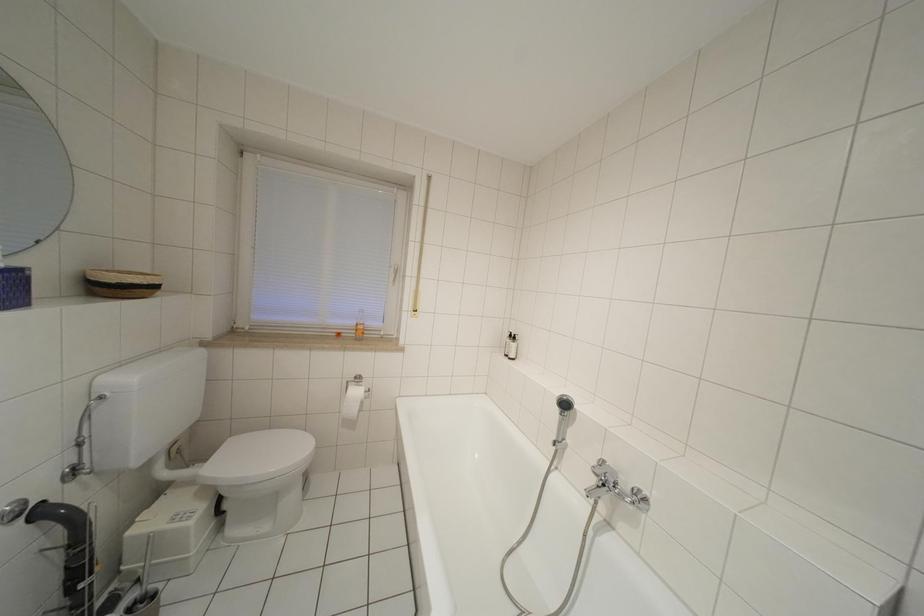
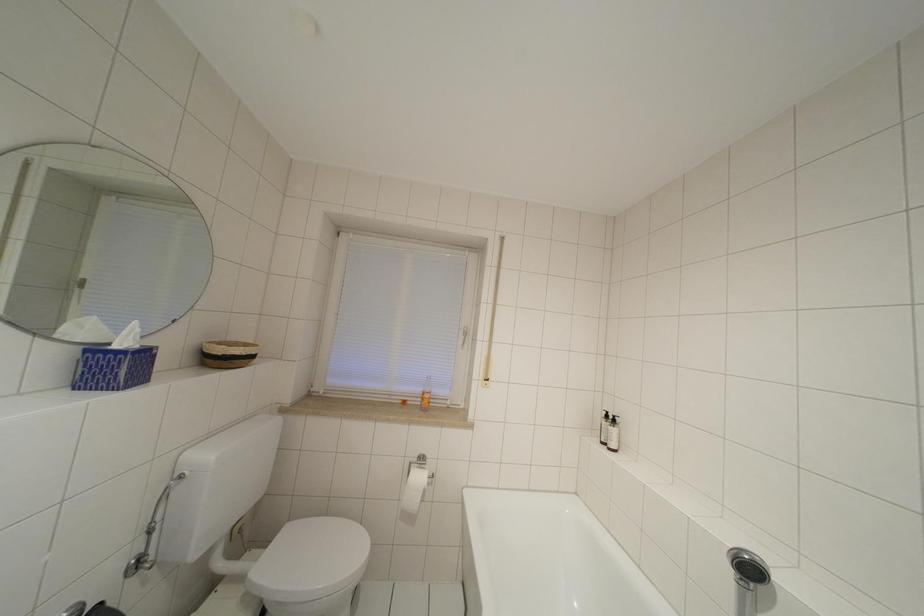
Question: The first image is from the beginning of the video and the second image is from the end. How did the camera likely rotate when shooting the video?

Choices:
 (A) Left
 (B) Right
 (C) Up
 (D) Down

Answer: (A)